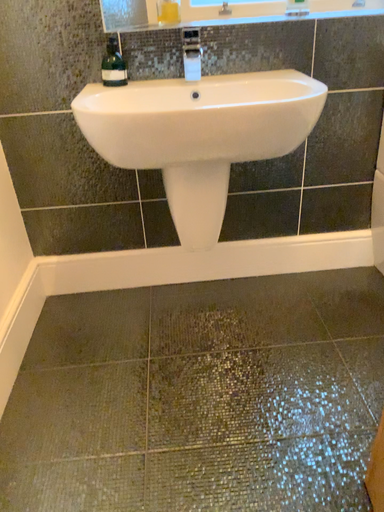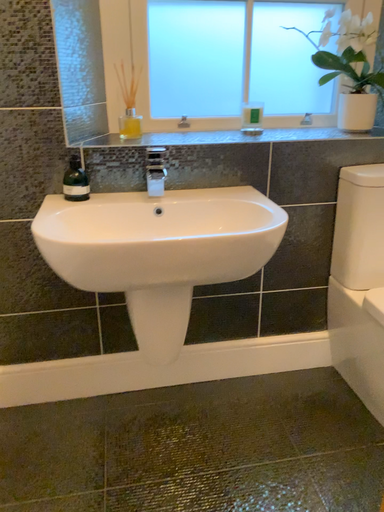
Question: Which way did the camera rotate in the video?

Choices:
 (A) rotated downward
 (B) rotated upward

Answer: (B)